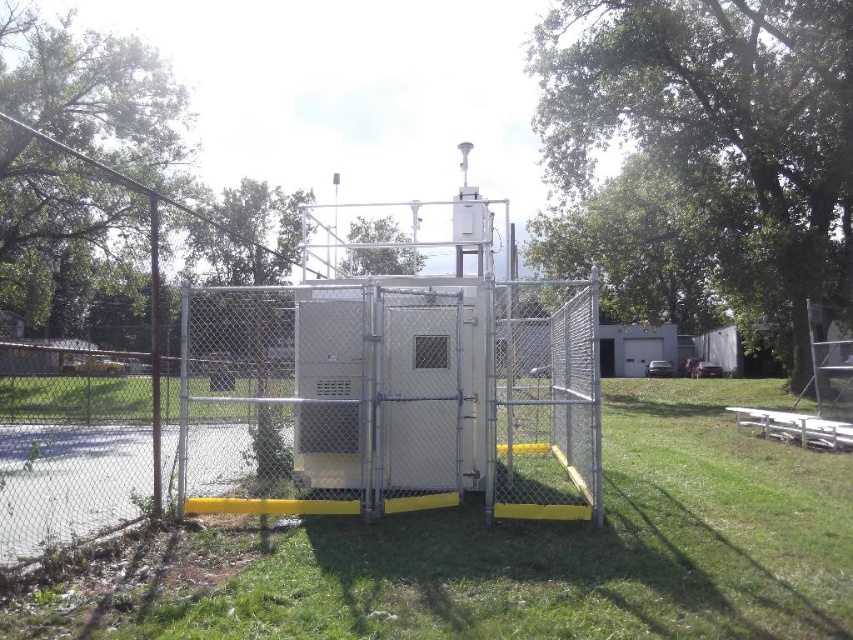
Which is in front, point (396, 467) or point (837, 422)?

Point (396, 467)

Does metallic gray cabinet at center appear under white wooden picnic table at lower right?

No.

Is point (234, 394) closer to viewer compared to point (809, 445)?

Yes.

Locate an element on the screen. This screenshot has width=853, height=640. metallic gray cabinet at center is located at coordinates (415, 401).

Can you confirm if green grass at lower center is positioned below white wooden picnic table at lower right?

Yes, green grass at lower center is below white wooden picnic table at lower right.

Does green grass at lower center appear on the right side of white wooden picnic table at lower right?

In fact, green grass at lower center is to the left of white wooden picnic table at lower right.

This screenshot has width=853, height=640. Find the location of `green grass at lower center`. green grass at lower center is located at coordinates (525, 552).

At what (x,y) coordinates should I click in order to perform the action: click on green grass at lower center. Please return your answer as a coordinate pair (x, y). Looking at the image, I should click on (525, 552).

Which of these two, green grass at lower center or metallic gray cabinet at center, stands taller?

metallic gray cabinet at center is taller.

Can you confirm if green grass at lower center is shorter than metallic gray cabinet at center?

Yes.

You are a GUI agent. You are given a task and a screenshot of the screen. Output one action in this format:
    pyautogui.click(x=<x>, y=<y>)
    Task: Click on the green grass at lower center
    This screenshot has height=640, width=853.
    Given the screenshot: What is the action you would take?
    pyautogui.click(x=525, y=552)